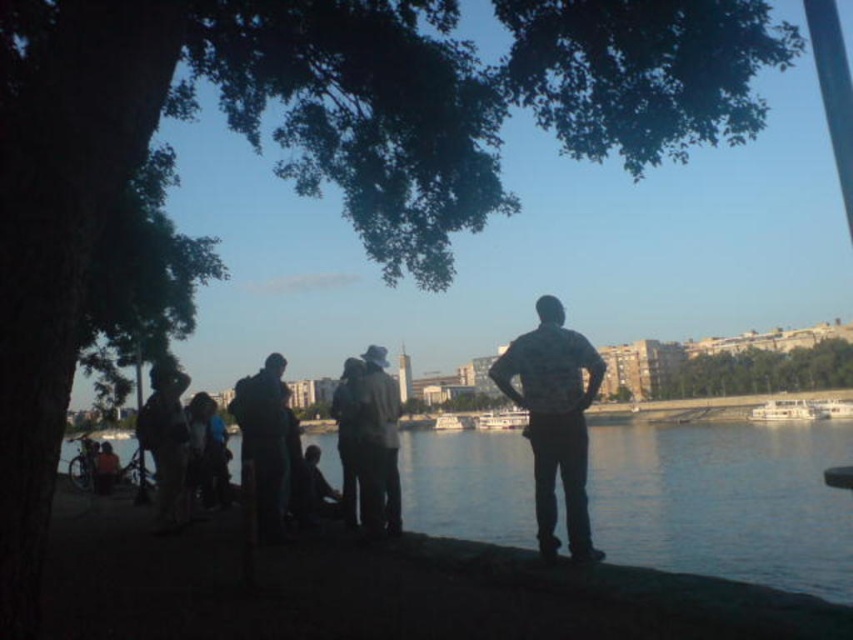
Question: Is blue water at lower center to the right of green leafy tree at center from the viewer's perspective?

Choices:
 (A) yes
 (B) no

Answer: (B)

Question: Based on their relative distances, which object is farther from the green leafy tree at center?

Choices:
 (A) blue water at lower center
 (B) dark gray fabric jacket at center

Answer: (B)

Question: Is camouflage-patterned shirt at center closer to camera compared to green leafy tree at center?

Choices:
 (A) yes
 (B) no

Answer: (A)

Question: Which object is positioned farthest from the green leafy tree at center?

Choices:
 (A) camouflage-patterned shirt at center
 (B) blue water at lower center

Answer: (A)

Question: Which of these objects is positioned farthest from the green leafy tree at center?

Choices:
 (A) dark gray fabric jacket at center
 (B) dark gray fabric hat at center

Answer: (A)

Question: Is blue water at lower center above dark gray fabric hat at center?

Choices:
 (A) no
 (B) yes

Answer: (A)